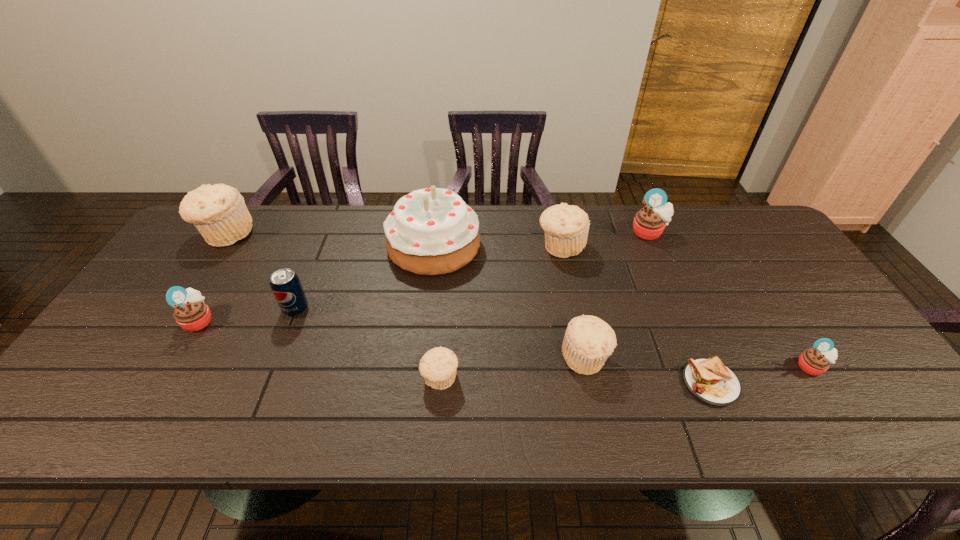
The image size is (960, 540). Identify the location of vacant space located 0.170m on the front-facing side of the second farthest pink muffin. (279, 320).

At what (x,y) coordinates should I click in order to perform the action: click on free space located on the right of the third biggest beige muffin. Please return your answer as a coordinate pair (x, y). Looking at the image, I should click on (761, 357).

The image size is (960, 540). Find the location of `vacant space located 0.120m on the front-facing side of the rightmost muffin`. vacant space located 0.120m on the front-facing side of the rightmost muffin is located at coordinates (850, 426).

This screenshot has height=540, width=960. In order to click on vacant area located on the left of the third beige muffin from right to left in this screenshot , I will do `click(275, 379)`.

Locate an element on the screen. This screenshot has width=960, height=540. free space located on the left of the shortest object is located at coordinates (575, 383).

Where is `cake that is positioned at the far edge`? cake that is positioned at the far edge is located at coordinates (432, 231).

Locate an element on the screen. This screenshot has width=960, height=540. object that is at the near edge is located at coordinates (709, 380).

Identify the location of object at the right edge. (815, 361).

Locate an element on the screen. This screenshot has width=960, height=540. object that is at the far left corner is located at coordinates pos(219,212).

At what (x,y) coordinates should I click in order to perform the action: click on free space at the far edge of the desktop. Please return your answer as a coordinate pair (x, y). The image size is (960, 540). Looking at the image, I should click on (272, 219).